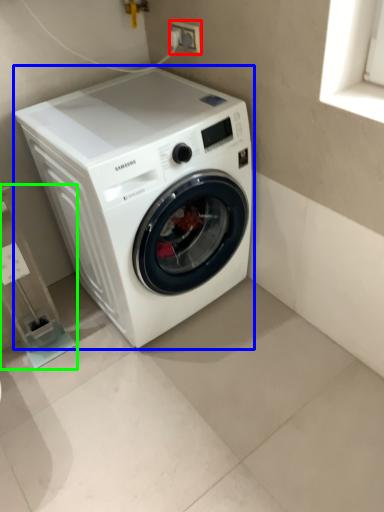
Question: Which object is positioned farthest from electric outlet (highlighted by a red box)? Select from washing machine (highlighted by a blue box) and shelf (highlighted by a green box).

Choices:
 (A) washing machine
 (B) shelf

Answer: (B)